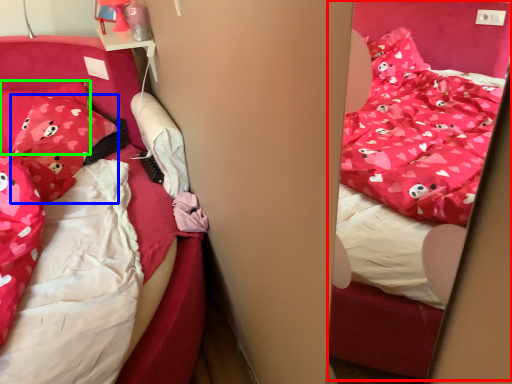
Question: Considering the real-world distances, which object is closest to bed (highlighted by a red box)? pillow (highlighted by a blue box) or pillow (highlighted by a green box).

Choices:
 (A) pillow
 (B) pillow

Answer: (A)